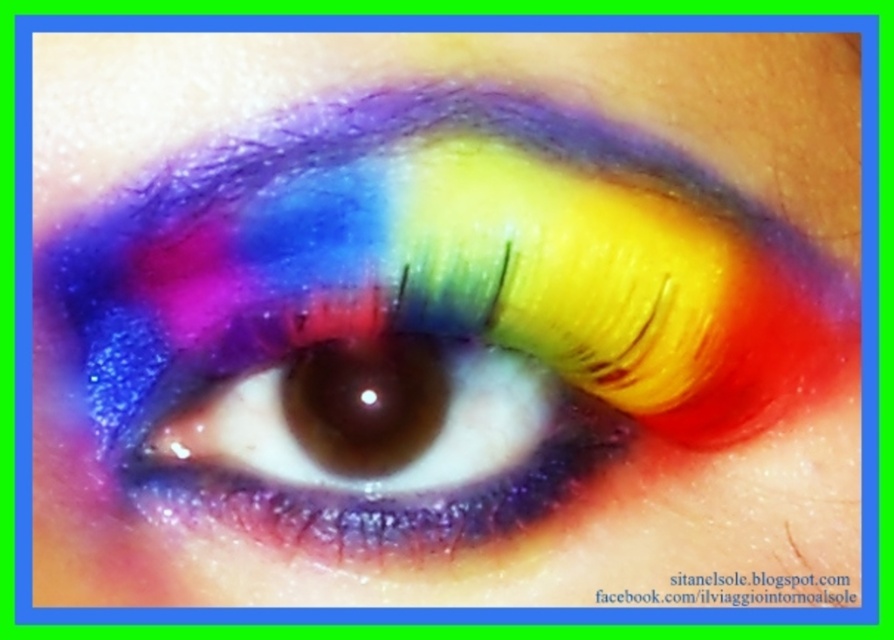
Question: Which point is farther from the camera taking this photo?

Choices:
 (A) (199, 429)
 (B) (254, 227)

Answer: (A)

Question: Is shimmering rainbow eye at center above shiny rainbow eye at center?

Choices:
 (A) yes
 (B) no

Answer: (A)

Question: Is shimmering rainbow eye at center wider than shiny rainbow eye at center?

Choices:
 (A) no
 (B) yes

Answer: (B)

Question: Among these objects, which one is farthest from the camera?

Choices:
 (A) shiny rainbow eye at center
 (B) shimmering rainbow eye at center

Answer: (A)

Question: Does shimmering rainbow eye at center have a greater width compared to shiny rainbow eye at center?

Choices:
 (A) yes
 (B) no

Answer: (A)